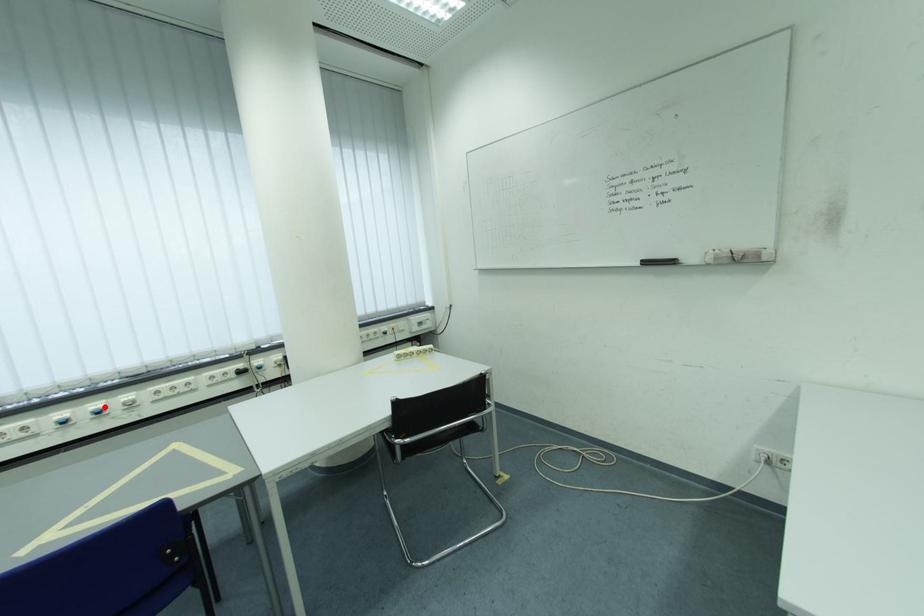
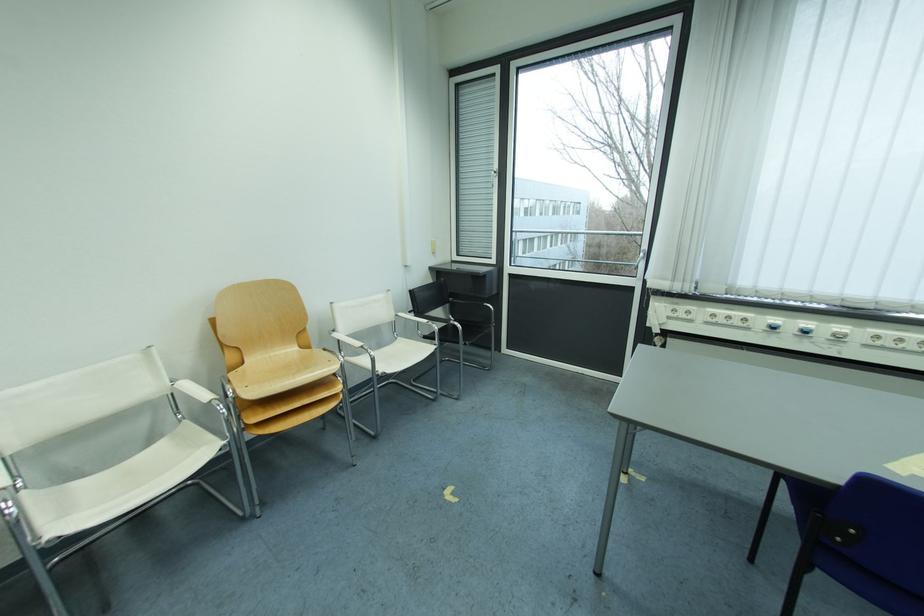
Find the pixel in the second image that matches the highlighted location in the first image.

(816, 326)